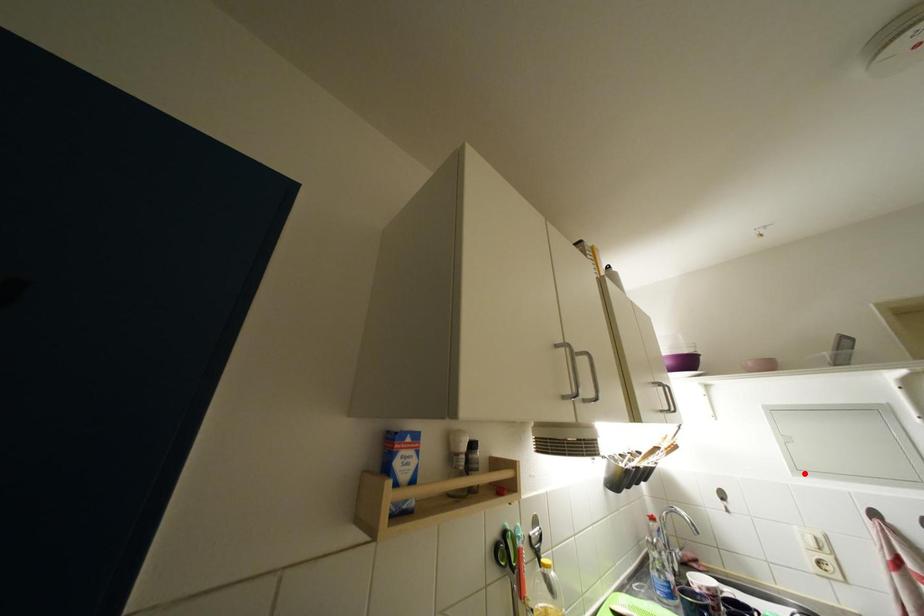
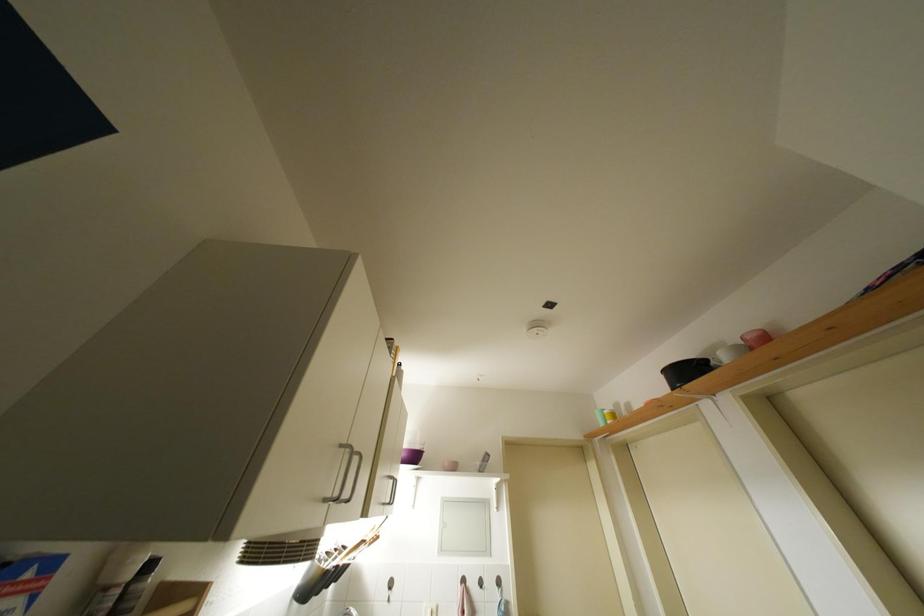
Locate, in the second image, the point that corresponds to the highlighted location in the first image.

(447, 554)